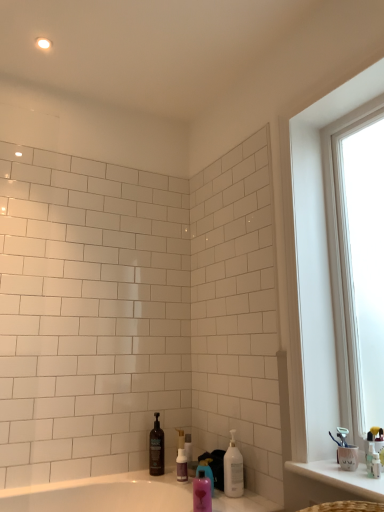
Where is `pink glossy bottle at lower center, which is the 2th cleaning product in right-to-left order`? This screenshot has width=384, height=512. pink glossy bottle at lower center, which is the 2th cleaning product in right-to-left order is located at coordinates (206, 471).

Consider the image. What is the approximate width of white glossy pump bottle at lower center, which appears as the 3th cleaning product when viewed from the back?

3.31 inches.

What do you see at coordinates (202, 493) in the screenshot? The width and height of the screenshot is (384, 512). I see `pink glossy mouthwash at lower center` at bounding box center [202, 493].

What do you see at coordinates (188, 447) in the screenshot? I see `clear plastic bottle at center, acting as the 1th toiletry starting from the back` at bounding box center [188, 447].

Where is `translucent purple bottle at lower center, which is the third toiletry from right to left`? This screenshot has width=384, height=512. translucent purple bottle at lower center, which is the third toiletry from right to left is located at coordinates (182, 466).

How much space does white plastic toothbrush at right, which is the third toiletry in bottom-to-top order, occupy vertically?

white plastic toothbrush at right, which is the third toiletry in bottom-to-top order, is 3.28 inches tall.

In order to click on pink glossy bottle at lower center, which is the 2th cleaning product in right-to-left order in this screenshot , I will do `click(206, 471)`.

Between transparent glass window at right and pink glossy bottle at lower center, which ranks as the 2th cleaning product in left-to-right order, which one has smaller size?

With smaller size is pink glossy bottle at lower center, which ranks as the 2th cleaning product in left-to-right order.

You are a GUI agent. You are given a task and a screenshot of the screen. Output one action in this format:
    pyautogui.click(x=<x>, y=<y>)
    Task: Click on the 2nd cleaning product behind when counting from the transparent glass window at right
    This screenshot has width=384, height=512.
    Given the screenshot: What is the action you would take?
    pyautogui.click(x=206, y=471)

Which object is positioned more to the left, transparent glass window at right or pink glossy bottle at lower center, placed as the 2th cleaning product when sorted from back to front?

From the viewer's perspective, pink glossy bottle at lower center, placed as the 2th cleaning product when sorted from back to front, appears more on the left side.

How different are the orientations of transparent glass window at right and pink glossy bottle at lower center, which is the 2th cleaning product in right-to-left order, in degrees?

0.579 degrees.

At what (x,y) coordinates should I click in order to perform the action: click on mouthwash below the transparent glass window at right (from a real-world perspective). Please return your answer as a coordinate pair (x, y). The image size is (384, 512). Looking at the image, I should click on (202, 493).

Does transparent glass window at right turn towards pink glossy mouthwash at lower center?

No, transparent glass window at right does not turn towards pink glossy mouthwash at lower center.

From the picture: Between transparent glass window at right and pink glossy mouthwash at lower center, which one is positioned in front?

transparent glass window at right is more forward.

Is transparent glass window at right located outside pink glossy mouthwash at lower center?

Indeed, transparent glass window at right is completely outside pink glossy mouthwash at lower center.

Is transparent glass window at right behind translucent purple bottle at lower center, the second toiletry in the front-to-back sequence?

No.

Is transparent glass window at right next to translucent purple bottle at lower center, which is counted as the 2th toiletry, starting from the top?

No, transparent glass window at right is not in contact with translucent purple bottle at lower center, which is counted as the 2th toiletry, starting from the top.

Can you tell me how much transparent glass window at right and translucent purple bottle at lower center, the second toiletry in the front-to-back sequence, differ in facing direction?

0.578 degrees separate the facing orientations of transparent glass window at right and translucent purple bottle at lower center, the second toiletry in the front-to-back sequence.

Who is shorter, transparent glass window at right or translucent purple bottle at lower center, the second toiletry in the front-to-back sequence?

translucent purple bottle at lower center, the second toiletry in the front-to-back sequence.

Can white plastic toothbrush at right, the 1th toiletry in the front-to-back sequence, be found inside pink glossy bottle at lower center, placed as the 2th cleaning product when sorted from back to front?

No, white plastic toothbrush at right, the 1th toiletry in the front-to-back sequence, is not a part of pink glossy bottle at lower center, placed as the 2th cleaning product when sorted from back to front.

Can you tell me how much pink glossy bottle at lower center, which ranks as the 2th cleaning product in left-to-right order, and white plastic toothbrush at right, the 1th toiletry in the top-to-bottom sequence, differ in facing direction?

The facing directions of pink glossy bottle at lower center, which ranks as the 2th cleaning product in left-to-right order, and white plastic toothbrush at right, the 1th toiletry in the top-to-bottom sequence, are 0.577 degrees apart.

From the image's perspective, is pink glossy bottle at lower center, placed as the 2th cleaning product when sorted from back to front, above or below white plastic toothbrush at right, the 1th toiletry in the front-to-back sequence?

Based on their image positions, pink glossy bottle at lower center, placed as the 2th cleaning product when sorted from back to front, is located beneath white plastic toothbrush at right, the 1th toiletry in the front-to-back sequence.

Can you confirm if pink glossy bottle at lower center, which ranks as the 2th cleaning product in left-to-right order, is positioned to the right of white plastic toothbrush at right, which is the third toiletry in bottom-to-top order?

No.

Which of these two, dark brown plastic bottle at center, the third cleaning product when ordered from right to left, or transparent glass window at right, stands taller?

With more height is transparent glass window at right.

From the image's perspective, which is below, dark brown plastic bottle at center, the 1th cleaning product in the left-to-right sequence, or transparent glass window at right?

dark brown plastic bottle at center, the 1th cleaning product in the left-to-right sequence, is shown below in the image.

Is dark brown plastic bottle at center, acting as the third cleaning product starting from the front, facing towards transparent glass window at right?

No, dark brown plastic bottle at center, acting as the third cleaning product starting from the front, is not facing towards transparent glass window at right.

Can you confirm if dark brown plastic bottle at center, the 1th cleaning product in the left-to-right sequence, is positioned to the right of transparent glass window at right?

Incorrect, dark brown plastic bottle at center, the 1th cleaning product in the left-to-right sequence, is not on the right side of transparent glass window at right.

How many degrees apart are the facing directions of clear plastic bottle at center, which is the 3th toiletry in top-to-bottom order, and transparent glass window at right?

clear plastic bottle at center, which is the 3th toiletry in top-to-bottom order, and transparent glass window at right are facing 0.579 degrees away from each other.

Does clear plastic bottle at center, arranged as the second toiletry when viewed from the right, lie in front of transparent glass window at right?

No, it is not.

Would you consider clear plastic bottle at center, the first toiletry ordered from the bottom, to be distant from transparent glass window at right?

Absolutely, clear plastic bottle at center, the first toiletry ordered from the bottom, is distant from transparent glass window at right.

Is clear plastic bottle at center, which is the 3th toiletry in top-to-bottom order, smaller than transparent glass window at right?

Yes.

From a real-world perspective, between pink glossy bottle at lower center, acting as the second cleaning product starting from the front, and white glossy pump bottle at lower center, which appears as the 3th cleaning product when viewed from the back, who is vertically lower?

pink glossy bottle at lower center, acting as the second cleaning product starting from the front, from a real-world perspective.

Between pink glossy bottle at lower center, placed as the 2th cleaning product when sorted from back to front, and white glossy pump bottle at lower center, the first cleaning product from the front, which one has more height?

With more height is white glossy pump bottle at lower center, the first cleaning product from the front.

Between pink glossy bottle at lower center, acting as the second cleaning product starting from the front, and white glossy pump bottle at lower center, which appears as the 3th cleaning product when viewed from the back, which one has larger width?

Wider between the two is white glossy pump bottle at lower center, which appears as the 3th cleaning product when viewed from the back.

From the picture: Are pink glossy bottle at lower center, which ranks as the 2th cleaning product in left-to-right order, and white glossy pump bottle at lower center, which appears as the 3th cleaning product when viewed from the back, making contact?

Yes, pink glossy bottle at lower center, which ranks as the 2th cleaning product in left-to-right order, is in contact with white glossy pump bottle at lower center, which appears as the 3th cleaning product when viewed from the back.

At what (x,y) coordinates should I click in order to perform the action: click on the 2nd cleaning product to the left when counting from the transparent glass window at right. Please return your answer as a coordinate pair (x, y). This screenshot has height=512, width=384. Looking at the image, I should click on (206, 471).

The height and width of the screenshot is (512, 384). I want to click on mouthwash below the transparent glass window at right (from a real-world perspective), so click(x=202, y=493).

From the image, which object appears to be nearer to translucent purple bottle at lower center, the 2th toiletry ordered from the bottom, white plastic toothbrush at right, the 1th toiletry in the top-to-bottom sequence, or pink glossy mouthwash at lower center?

Based on the image, pink glossy mouthwash at lower center appears to be nearer to translucent purple bottle at lower center, the 2th toiletry ordered from the bottom.

Considering their positions, is clear plastic bottle at center, which ranks as the second toiletry in left-to-right order, positioned closer to white glossy pump bottle at lower center, the first cleaning product from the front, than white plastic toothbrush at right, the 1th toiletry in the front-to-back sequence?

Based on the image, clear plastic bottle at center, which ranks as the second toiletry in left-to-right order, appears to be nearer to white glossy pump bottle at lower center, the first cleaning product from the front.

Consider the image. From the image, which object appears to be farther from white plastic toothbrush at right, the 3th toiletry when ordered from back to front, pink glossy bottle at lower center, placed as the 2th cleaning product when sorted from back to front, or transparent glass window at right?

Based on the image, transparent glass window at right appears to be further to white plastic toothbrush at right, the 3th toiletry when ordered from back to front.

From the image, which object appears to be nearer to pink glossy mouthwash at lower center, white glossy pump bottle at lower center, the first cleaning product from the front, or dark brown plastic bottle at center, acting as the third cleaning product starting from the front?

white glossy pump bottle at lower center, the first cleaning product from the front.

From the image, which object appears to be farther from dark brown plastic bottle at center, the first cleaning product when ordered from back to front, white glossy pump bottle at lower center, placed as the third cleaning product when sorted from left to right, or pink glossy mouthwash at lower center?

Based on the image, pink glossy mouthwash at lower center appears to be further to dark brown plastic bottle at center, the first cleaning product when ordered from back to front.

Estimate the real-world distances between objects in this image. Which object is closer to dark brown plastic bottle at center, the 1th cleaning product in the left-to-right sequence, pink glossy bottle at lower center, acting as the second cleaning product starting from the front, or transparent glass window at right?

Based on the image, pink glossy bottle at lower center, acting as the second cleaning product starting from the front, appears to be nearer to dark brown plastic bottle at center, the 1th cleaning product in the left-to-right sequence.

Estimate the real-world distances between objects in this image. Which object is closer to clear plastic bottle at center, arranged as the second toiletry when viewed from the right, dark brown plastic bottle at center, the third cleaning product when ordered from right to left, or pink glossy bottle at lower center, which is the 2th cleaning product in right-to-left order?

dark brown plastic bottle at center, the third cleaning product when ordered from right to left, lies closer to clear plastic bottle at center, arranged as the second toiletry when viewed from the right, than the other object.

Which object lies nearer to the anchor point white glossy pump bottle at lower center, which is the first cleaning product in right-to-left order, pink glossy mouthwash at lower center or pink glossy bottle at lower center, placed as the 2th cleaning product when sorted from back to front?

The object closer to white glossy pump bottle at lower center, which is the first cleaning product in right-to-left order, is pink glossy bottle at lower center, placed as the 2th cleaning product when sorted from back to front.

The width and height of the screenshot is (384, 512). I want to click on cleaning product between white glossy pump bottle at lower center, placed as the third cleaning product when sorted from left to right, and translucent purple bottle at lower center, which is the third toiletry from right to left, along the z-axis, so click(x=206, y=471).

Where is `mouthwash located between dark brown plastic bottle at center, the third cleaning product when ordered from right to left, and white plastic toothbrush at right, arranged as the third toiletry when viewed from the left, in the left-right direction`? mouthwash located between dark brown plastic bottle at center, the third cleaning product when ordered from right to left, and white plastic toothbrush at right, arranged as the third toiletry when viewed from the left, in the left-right direction is located at coordinates (202, 493).

In order to click on toiletry between pink glossy bottle at lower center, which is the 2th cleaning product in right-to-left order, and clear plastic bottle at center, arranged as the third toiletry when viewed from the front, along the z-axis in this screenshot , I will do `click(182, 466)`.

Image resolution: width=384 pixels, height=512 pixels. I want to click on cleaning product between pink glossy bottle at lower center, which ranks as the 2th cleaning product in left-to-right order, and white plastic toothbrush at right, which is the third toiletry in bottom-to-top order, from left to right, so click(x=233, y=469).